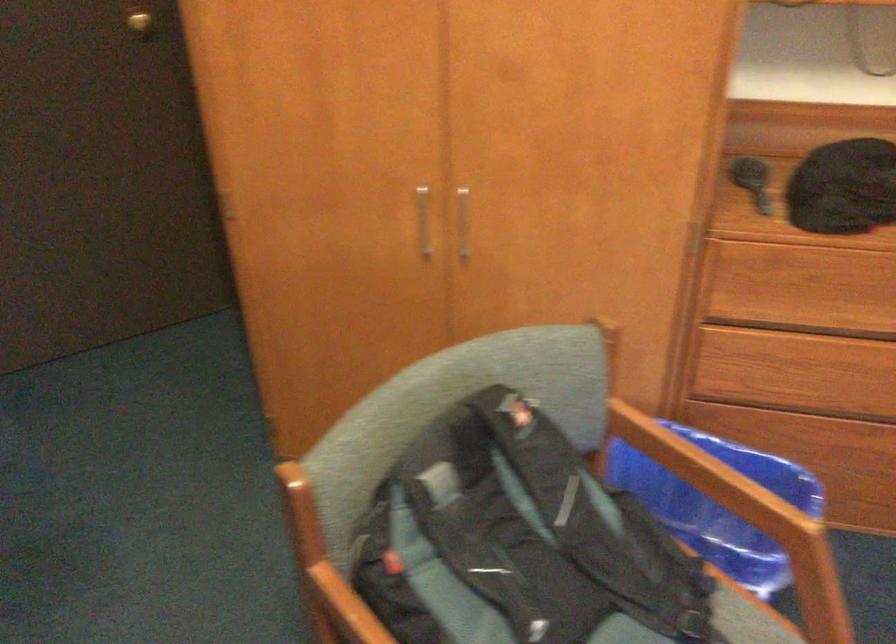
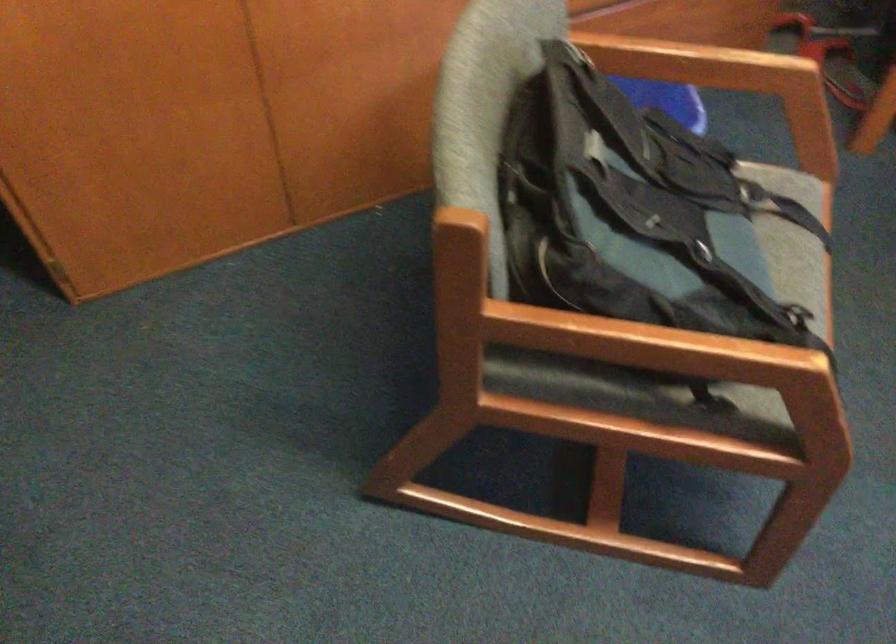
The first image is from the beginning of the video and the second image is from the end. How did the camera likely rotate when shooting the video?

The rotation direction of the camera is right-down.